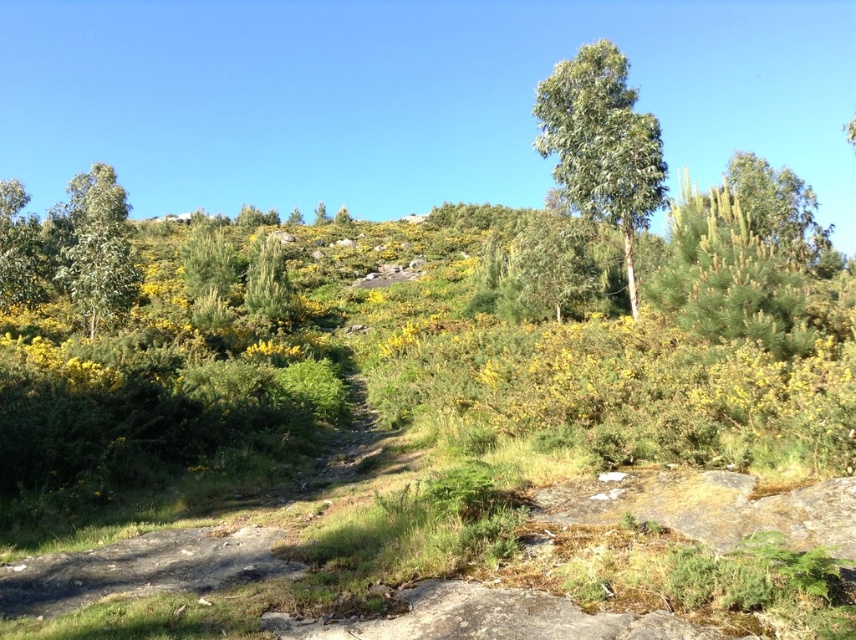
Is green leafy tree at upper center shorter than green matte tree at upper left?

Yes, green leafy tree at upper center is shorter than green matte tree at upper left.

Is point (633, 148) less distant than point (46, 262)?

That is True.

At what (x,y) coordinates should I click in order to perform the action: click on green leafy tree at upper center. Please return your answer as a coordinate pair (x, y). The height and width of the screenshot is (640, 856). Looking at the image, I should click on (601, 144).

Identify the location of green leafy tree at left. (96, 246).

Is point (327, 476) in front of point (21, 236)?

Yes.

Can you confirm if green grassy trail at center is thinner than green matte tree at upper left?

Correct, green grassy trail at center's width is less than green matte tree at upper left's.

Locate an element on the screen. The width and height of the screenshot is (856, 640). green grassy trail at center is located at coordinates (193, 529).